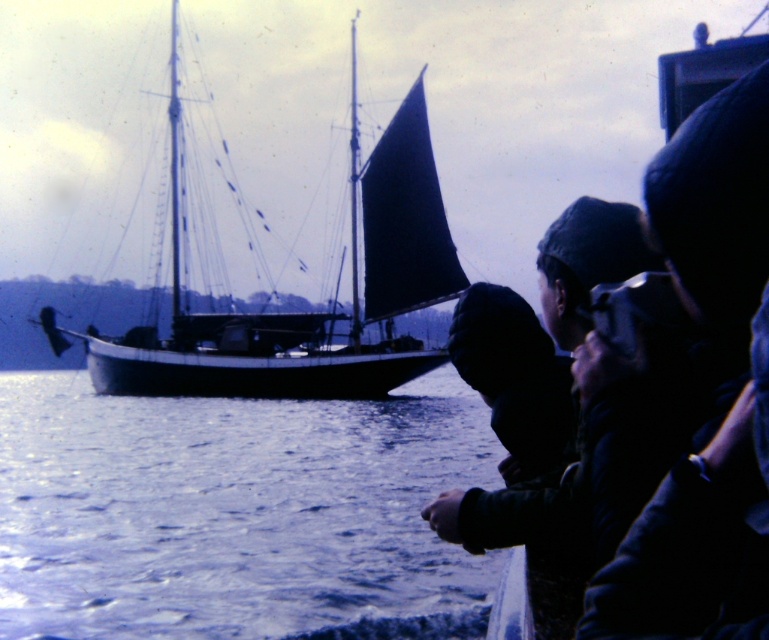
Question: Is blue water at lower left further to camera compared to dark blue canvas sailboat at left?

Choices:
 (A) no
 (B) yes

Answer: (A)

Question: Which of the following is the closest to the observer?

Choices:
 (A) blue water at lower left
 (B) dark blue canvas sailboat at left

Answer: (A)

Question: Which point is farther to the camera?

Choices:
 (A) dark blue canvas sailboat at left
 (B) blue water at lower left

Answer: (A)

Question: Can you confirm if blue water at lower left is smaller than dark blue canvas sailboat at left?

Choices:
 (A) no
 (B) yes

Answer: (B)

Question: Is blue water at lower left positioned behind dark blue canvas sailboat at left?

Choices:
 (A) yes
 (B) no

Answer: (B)